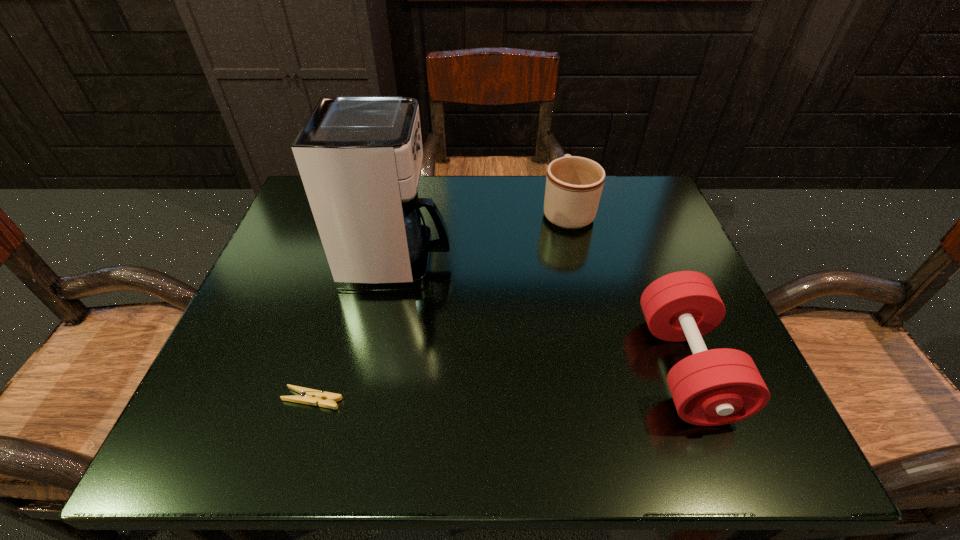
Find the location of a particular element. free space between the rightmost object and the coffee maker is located at coordinates (541, 314).

Locate an element on the screen. The height and width of the screenshot is (540, 960). free space between the clothespin and the rightmost object is located at coordinates tap(499, 383).

Where is `empty location between the farthest object and the clothespin`? Image resolution: width=960 pixels, height=540 pixels. empty location between the farthest object and the clothespin is located at coordinates (440, 305).

Identify the location of vacant region between the coffee maker and the rightmost object. (541, 314).

Select which object appears as the second closest to the dumbbell. Please provide its 2D coordinates. Your answer should be formatted as a tuple, i.e. [(x, y)], where the tuple contains the x and y coordinates of a point satisfying the conditions above.

[(359, 157)]

You are a GUI agent. You are given a task and a screenshot of the screen. Output one action in this format:
    pyautogui.click(x=<x>, y=<y>)
    Task: Click on the third closest object relative to the second farthest object
    The height and width of the screenshot is (540, 960).
    Given the screenshot: What is the action you would take?
    pyautogui.click(x=714, y=387)

You are a GUI agent. You are given a task and a screenshot of the screen. Output one action in this format:
    pyautogui.click(x=<x>, y=<y>)
    Task: Click on the vacant space that satisfies the following two spatial constraints: 1. on the front panel of the tallest object; 2. on the back side of the dumbbell
    The image size is (960, 540).
    Given the screenshot: What is the action you would take?
    pyautogui.click(x=378, y=367)

Image resolution: width=960 pixels, height=540 pixels. I want to click on free location that satisfies the following two spatial constraints: 1. on the front panel of the tallest object; 2. on the right side of the dumbbell, so click(x=378, y=367).

The width and height of the screenshot is (960, 540). Find the location of `vacant space that satisfies the following two spatial constraints: 1. on the front panel of the tallest object; 2. on the back side of the dumbbell`. vacant space that satisfies the following two spatial constraints: 1. on the front panel of the tallest object; 2. on the back side of the dumbbell is located at coordinates (378, 367).

The height and width of the screenshot is (540, 960). What are the coordinates of `vacant space that satisfies the following two spatial constraints: 1. on the front panel of the rightmost object; 2. on the right side of the tallest object` in the screenshot? It's located at (378, 367).